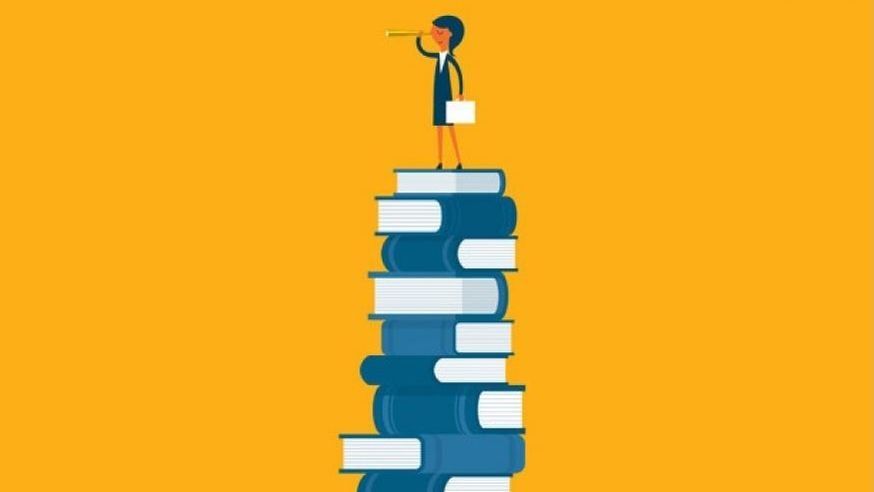
Locate an element on the screen. The image size is (874, 492). books with spines facing to the left is located at coordinates tap(437, 483), tap(434, 411), tap(413, 371), tap(438, 337), tap(434, 251).